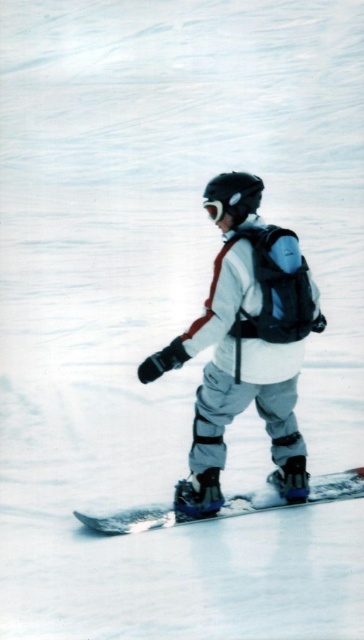
Who is positioned more to the right, white matte snowboarder at center or white plastic snowboard at center?

From the viewer's perspective, white matte snowboarder at center appears more on the right side.

Where is `white matte snowboarder at center`? This screenshot has height=640, width=364. white matte snowboarder at center is located at coordinates (247, 356).

Is point (231, 396) more distant than point (334, 474)?

No, it is in front of (334, 474).

Where is `white matte snowboarder at center`? white matte snowboarder at center is located at coordinates pyautogui.click(x=247, y=356).

Is white matte snowboarder at center below white matte goggles at center?

Indeed, white matte snowboarder at center is positioned under white matte goggles at center.

Which is behind, point (309, 275) or point (223, 195)?

Point (309, 275)

Between point (247, 221) and point (234, 212), which one is positioned in front?

Positioned in front is point (234, 212).

At what (x,y) coordinates should I click in order to perform the action: click on white matte snowboarder at center. Please return your answer as a coordinate pair (x, y). The image size is (364, 640). Looking at the image, I should click on point(247,356).

In order to click on white plastic snowboard at center in this screenshot , I will do `click(180, 513)`.

Can you confirm if white plastic snowboard at center is taller than white matte goggles at center?

In fact, white plastic snowboard at center may be shorter than white matte goggles at center.

Find the location of `white plastic snowboard at center`. white plastic snowboard at center is located at coordinates (180, 513).